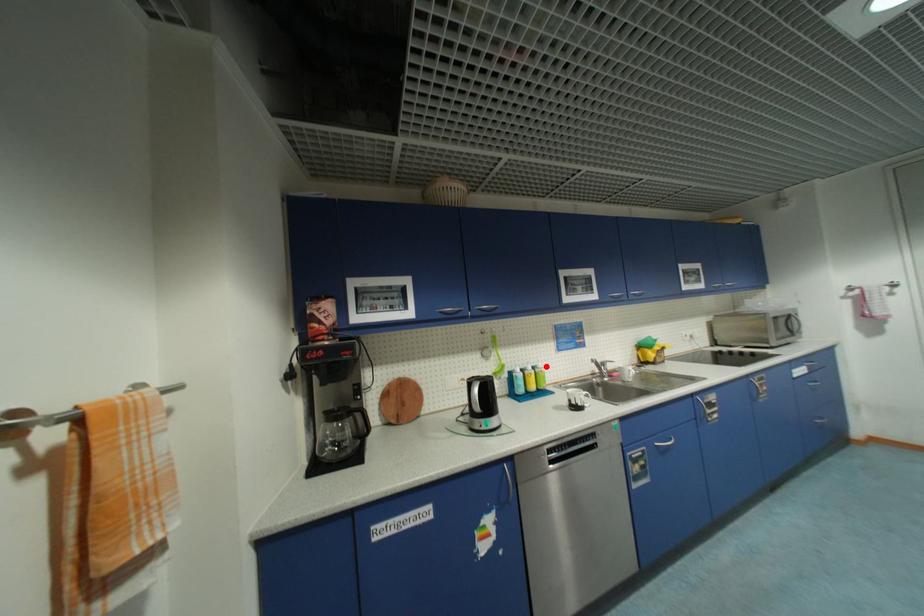
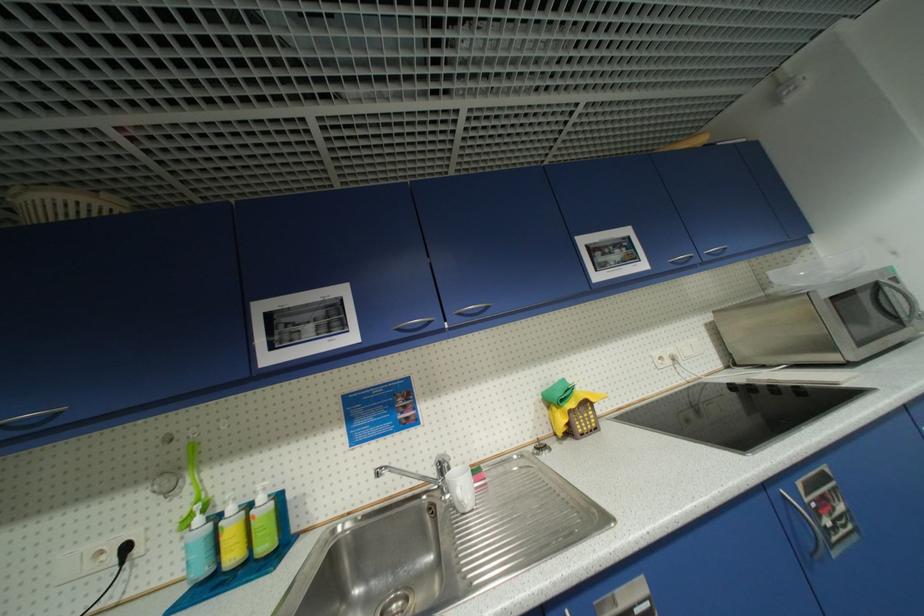
Find the pixel in the second image that matches the highlighted location in the first image.

(266, 500)